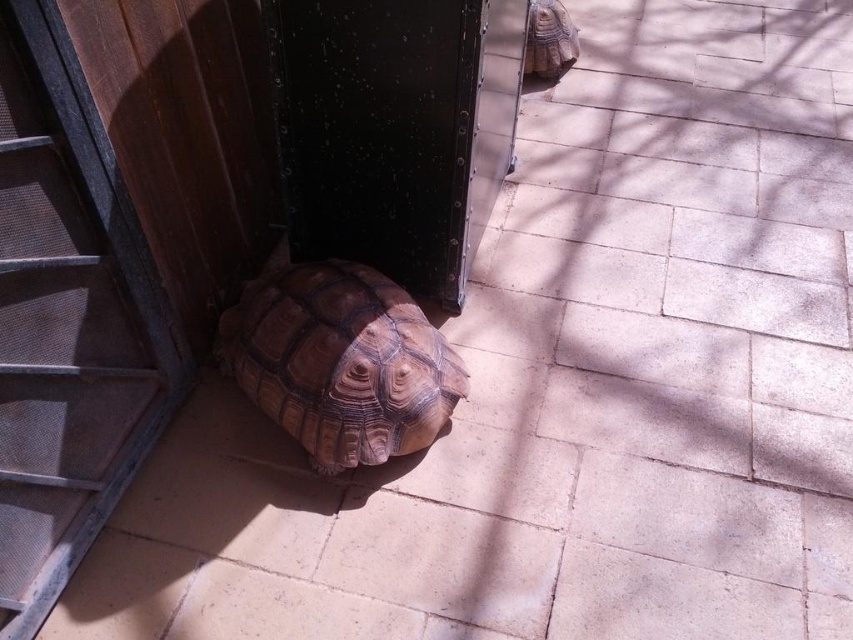
You are a delivery robot trying to reach the transparent glass door at lower left. There is a brown textured tortoise at upper right in your path. Based on the scene, can you safely navigate around the tortoise to reach the door?

The transparent glass door at lower left is located below the brown textured tortoise at upper right, so the tortoise is positioned above the door from your perspective. This means the tortoise is not blocking the path to the door, so you can safely navigate around it to reach the door.

You are standing at the point labeled point (x=531, y=24) and want to walk to the tortoise. Which direction should you move relative to point (x=299, y=428)?

You should move towards point (x=299, y=428), which is in front of point (x=531, y=24), to reach the tortoise.

You are standing at the entrance of the enclosure and want to exit through the transparent glass door at lower left. The brown textured tortoise at upper right is blocking your path. Can you walk around it to reach the door?

The transparent glass door at lower left is in front of the brown textured tortoise at upper right, meaning the tortoise is between you and the door. Therefore, you cannot walk around it to reach the door directly without moving the tortoise.